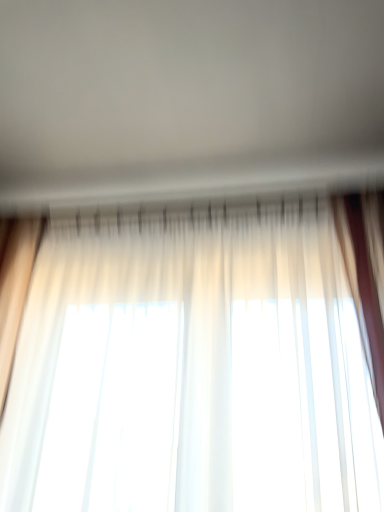
What do you see at coordinates (187, 99) in the screenshot? Image resolution: width=384 pixels, height=512 pixels. I see `white sheer curtains at center` at bounding box center [187, 99].

Find the location of `white sheer curtains at center`. white sheer curtains at center is located at coordinates (187, 99).

What is the approximate height of white sheer curtains at center?

The height of white sheer curtains at center is 2.30 inches.

I want to click on sheer white curtain at center, so 196,366.

Describe the element at coordinates (196, 366) in the screenshot. I see `sheer white curtain at center` at that location.

Where is `white sheer curtains at center`? The width and height of the screenshot is (384, 512). white sheer curtains at center is located at coordinates (187, 99).

Would you say sheer white curtain at center is to the left or to the right of white sheer curtains at center in the picture?

Clearly, sheer white curtain at center is on the right of white sheer curtains at center in the image.

Relative to white sheer curtains at center, is sheer white curtain at center in front or behind?

Visually, sheer white curtain at center is located behind white sheer curtains at center.

Which is closer to the camera, (269, 431) or (115, 86)?

Point (269, 431) is closer to the camera than point (115, 86).

From the image's perspective, which is below, sheer white curtain at center or white sheer curtains at center?

sheer white curtain at center, from the image's perspective.

From a real-world perspective, who is located lower, sheer white curtain at center or white sheer curtains at center?

sheer white curtain at center is physically lower.

Does sheer white curtain at center have a greater width compared to white sheer curtains at center?

No.

Who is taller, sheer white curtain at center or white sheer curtains at center?

sheer white curtain at center is taller.

From the picture: Does sheer white curtain at center have a larger size compared to white sheer curtains at center?

Yes.

Is sheer white curtain at center inside the boundaries of white sheer curtains at center, or outside?

sheer white curtain at center cannot be found inside white sheer curtains at center.

Are sheer white curtain at center and white sheer curtains at center beside each other?

sheer white curtain at center and white sheer curtains at center are clearly separated.

Is sheer white curtain at center aimed at white sheer curtains at center?

No, sheer white curtain at center is not aimed at white sheer curtains at center.

This screenshot has height=512, width=384. What are the coordinates of `curtain on the right of the white sheer curtains at center` in the screenshot? It's located at (196, 366).

Can you confirm if white sheer curtains at center is positioned to the right of sheer white curtain at center?

Incorrect, white sheer curtains at center is not on the right side of sheer white curtain at center.

Considering the positions of objects white sheer curtains at center and sheer white curtain at center in the image provided, who is in front, white sheer curtains at center or sheer white curtain at center?

Positioned in front is white sheer curtains at center.

Which is closer to the camera, (70,53) or (371,380)?

Clearly, point (70,53) is more distant from the camera than point (371,380).

From the image's perspective, is white sheer curtains at center located above sheer white curtain at center?

Yes.

From a real-world perspective, which object stands above the other?

white sheer curtains at center is physically above.

In terms of width, does white sheer curtains at center look wider or thinner when compared to sheer white curtain at center?

Considering their sizes, white sheer curtains at center looks broader than sheer white curtain at center.

Considering the relative sizes of white sheer curtains at center and sheer white curtain at center in the image provided, is white sheer curtains at center taller than sheer white curtain at center?

Incorrect, the height of white sheer curtains at center is not larger of that of sheer white curtain at center.

Considering the sizes of white sheer curtains at center and sheer white curtain at center in the image, is white sheer curtains at center bigger or smaller than sheer white curtain at center?

Considering their sizes, white sheer curtains at center takes up less space than sheer white curtain at center.

Is white sheer curtains at center inside or outside of sheer white curtain at center?

white sheer curtains at center is spatially situated outside sheer white curtain at center.

Is the surface of white sheer curtains at center in direct contact with sheer white curtain at center?

white sheer curtains at center is not next to sheer white curtain at center, and they're not touching.

Is white sheer curtains at center facing towards sheer white curtain at center?

No, white sheer curtains at center is not turned towards sheer white curtain at center.

How different are the orientations of white sheer curtains at center and sheer white curtain at center in degrees?

The facing directions of white sheer curtains at center and sheer white curtain at center are 87.9 degrees apart.

I want to click on backdrop to the left of sheer white curtain at center, so click(187, 99).

This screenshot has height=512, width=384. Find the location of `backdrop that appears above the sheer white curtain at center (from the image's perspective)`. backdrop that appears above the sheer white curtain at center (from the image's perspective) is located at coordinates (187, 99).

Locate an element on the screen. Image resolution: width=384 pixels, height=512 pixels. curtain on the right of white sheer curtains at center is located at coordinates (196, 366).